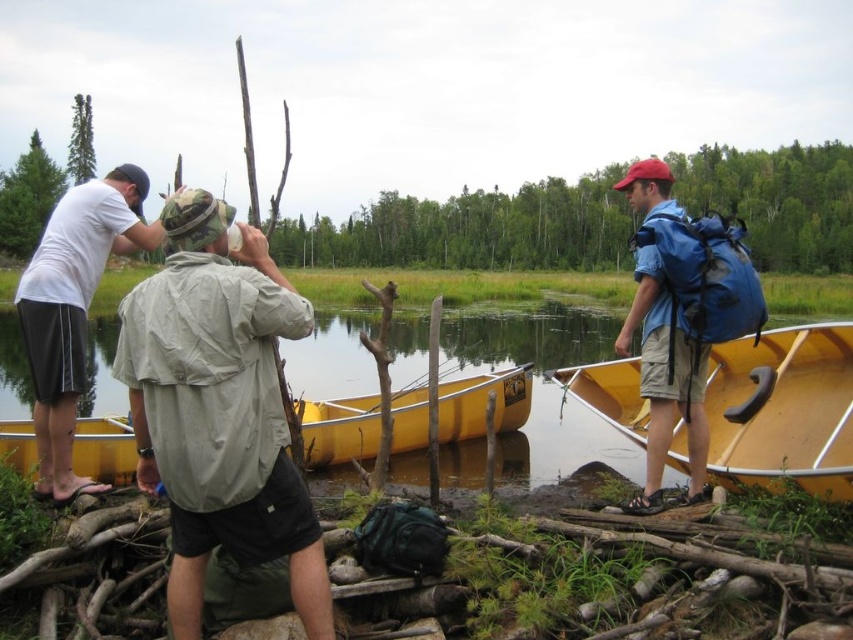
You are standing at point [770,376] and want to walk to the nearest canoe. Which direction should you go relative to point [637,301]?

You should go towards point [637,301] because it is in front of point [770,376] and closer to the canoes.

What is the purpose of the point labeled at coordinates (x=219, y=408) in the scene?

The point labeled at (x=219, y=408) marks the location of the khaki fabric shirt at center.